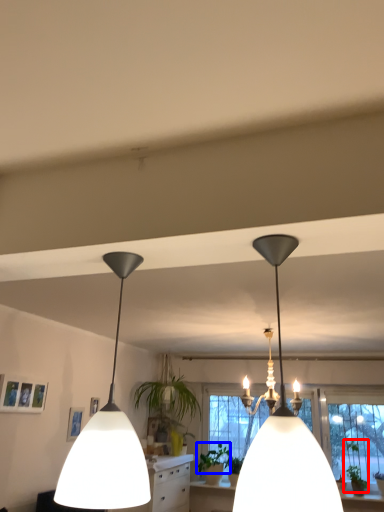
Question: Which object appears closest to the camera in this image, plant (highlighted by a red box) or plant (highlighted by a blue box)?

Choices:
 (A) plant
 (B) plant

Answer: (A)